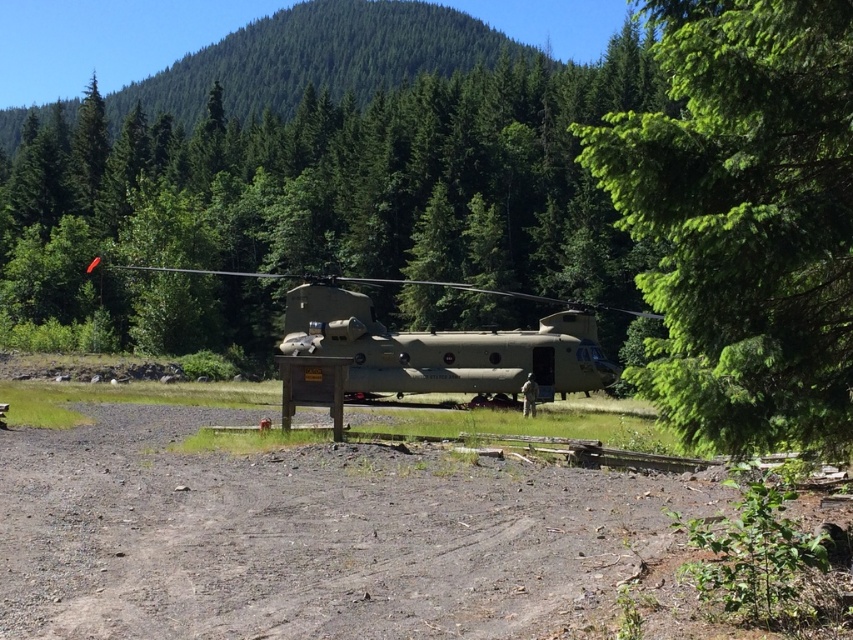
Question: Is dull brown dirt at center positioned behind green leafy tree at center?

Choices:
 (A) no
 (B) yes

Answer: (A)

Question: Where is green leafy tree at center located in relation to matte green helicopter at center in the image?

Choices:
 (A) below
 (B) above

Answer: (B)

Question: Is dull brown dirt at center above matte green helicopter at center?

Choices:
 (A) no
 (B) yes

Answer: (A)

Question: Estimate the real-world distances between objects in this image. Which object is closer to the green leafy tree at center?

Choices:
 (A) dull brown dirt at center
 (B) matte green helicopter at center

Answer: (A)

Question: Which point is closer to the camera?

Choices:
 (A) (769, 252)
 (B) (289, 579)

Answer: (A)

Question: Among these points, which one is nearest to the camera?

Choices:
 (A) (316, 301)
 (B) (229, 540)

Answer: (B)